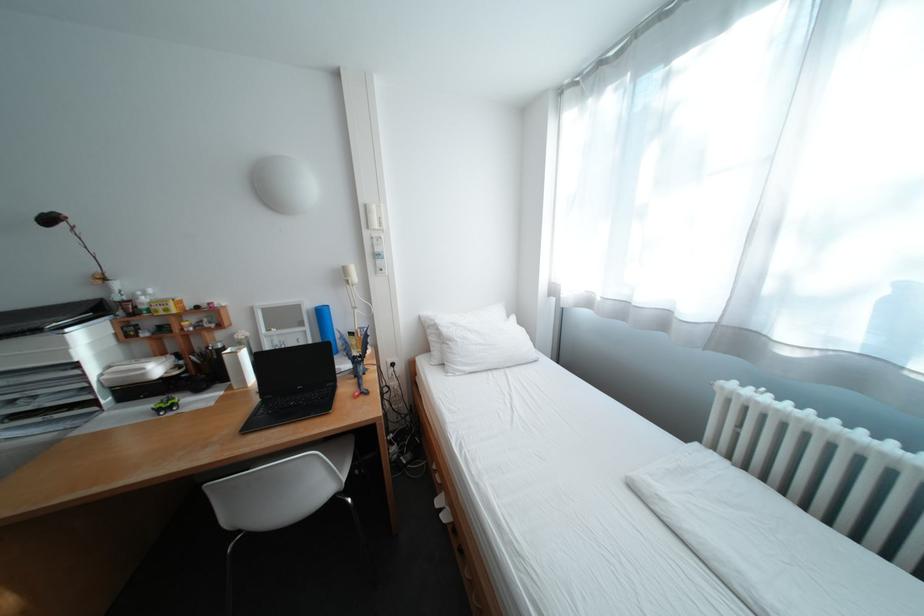
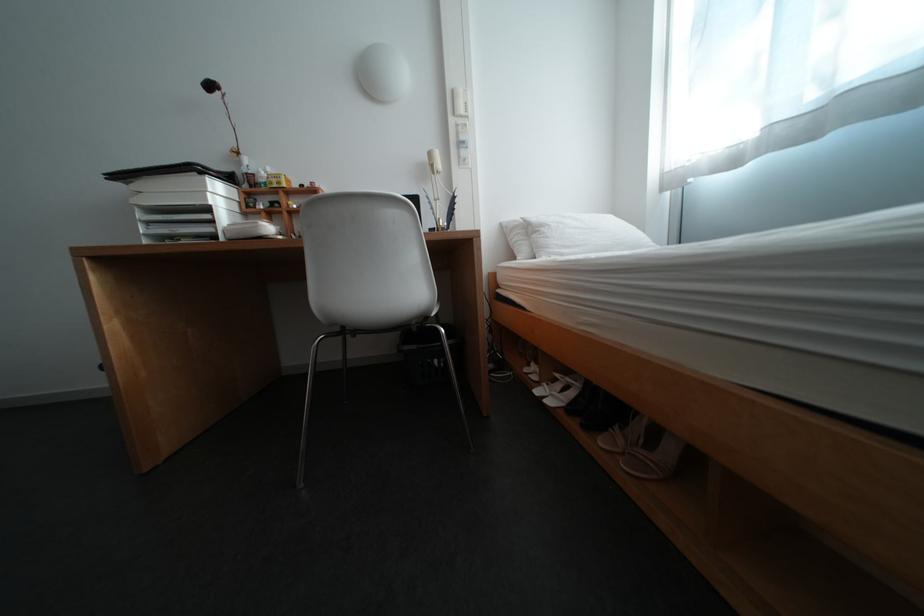
Find the pixel in the second image that matches pixel 465 342 in the first image.

(555, 228)